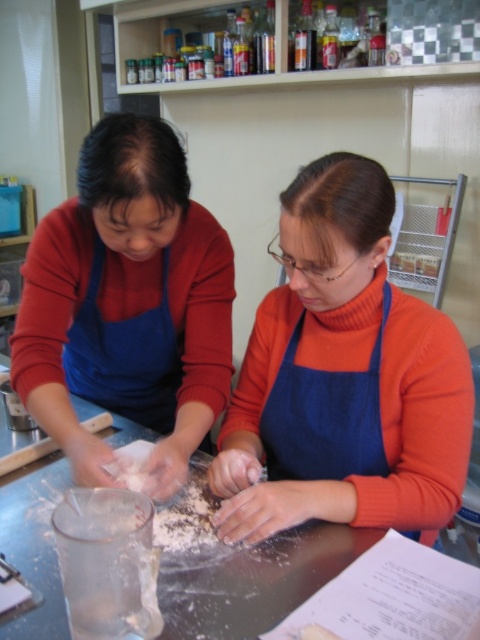
Question: Is blue fabric apron at center wider than metallic gray table at center?

Choices:
 (A) no
 (B) yes

Answer: (A)

Question: Which object is closer to the camera taking this photo?

Choices:
 (A) blue fabric apron at center
 (B) metallic gray table at center

Answer: (B)

Question: Which of the following is the farthest from the observer?

Choices:
 (A) (28, 637)
 (B) (352, 275)

Answer: (B)

Question: Is blue fabric apron at center to the left of metallic gray table at center from the viewer's perspective?

Choices:
 (A) no
 (B) yes

Answer: (A)

Question: Is blue fabric apron at center closer to the viewer compared to metallic gray table at center?

Choices:
 (A) yes
 (B) no

Answer: (B)